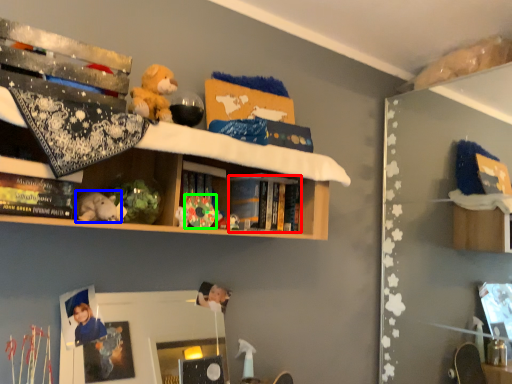
Question: Which object is positioned closest to book (highlighted by a red box)? Select from toy (highlighted by a blue box) and toy (highlighted by a green box).

Choices:
 (A) toy
 (B) toy

Answer: (B)